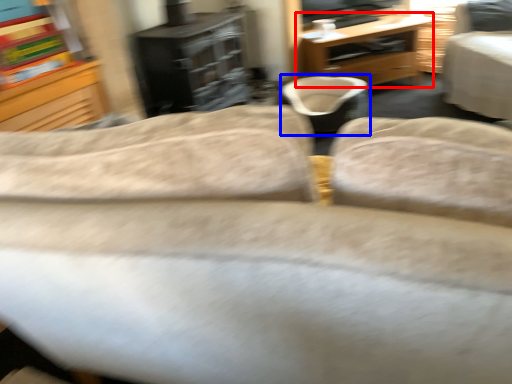
Question: Among these objects, which one is farthest to the camera, desk (highlighted by a red box) or bean bag chair (highlighted by a blue box)?

Choices:
 (A) desk
 (B) bean bag chair

Answer: (A)